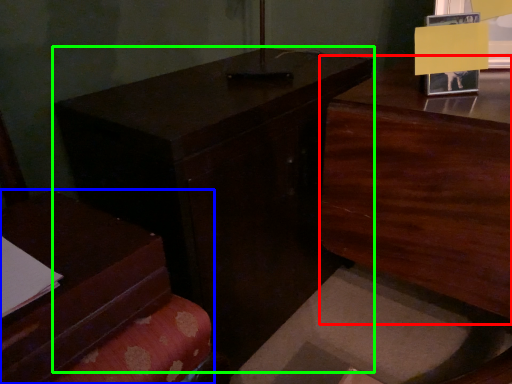
Question: Which object is the farthest from dresser (highlighted by a red box)? Choose among these: furniture (highlighted by a blue box) or table (highlighted by a green box).

Choices:
 (A) furniture
 (B) table

Answer: (A)